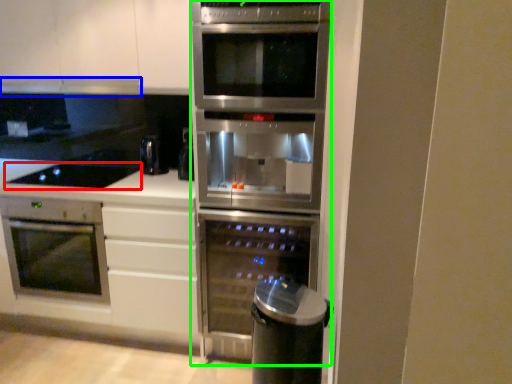
Question: Estimate the real-world distances between objects in this image. Which object is closer to gas stove (highlighted by a red box), exhaust hood (highlighted by a blue box) or fridge (highlighted by a green box)?

Choices:
 (A) exhaust hood
 (B) fridge

Answer: (A)